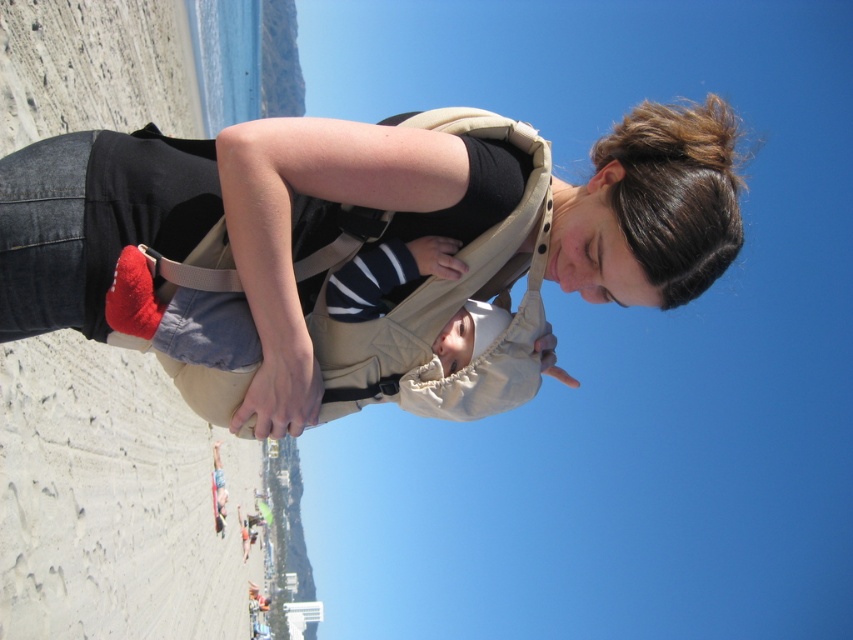
Question: Considering the relative positions of matte beige baby carrier at center and tan fabric strap at center in the image provided, where is matte beige baby carrier at center located with respect to tan fabric strap at center?

Choices:
 (A) below
 (B) above

Answer: (B)

Question: Is matte beige baby carrier at center wider than tan fabric strap at center?

Choices:
 (A) yes
 (B) no

Answer: (A)

Question: Which point is farther from the camera taking this photo?

Choices:
 (A) (276, 358)
 (B) (345, 225)

Answer: (B)

Question: Is matte beige baby carrier at center thinner than tan fabric strap at center?

Choices:
 (A) no
 (B) yes

Answer: (A)